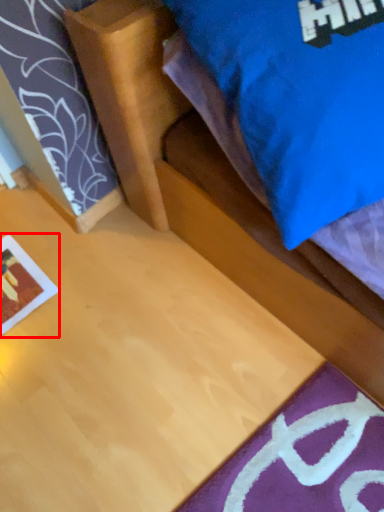
Question: In this image, where is print (annotated by the red box) located relative to bed?

Choices:
 (A) right
 (B) left

Answer: (B)